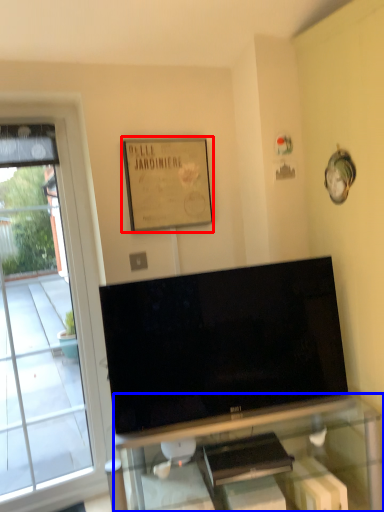
Question: Which point is closer to the camera, picture frame (highlighted by a red box) or furniture (highlighted by a blue box)?

Choices:
 (A) picture frame
 (B) furniture

Answer: (B)